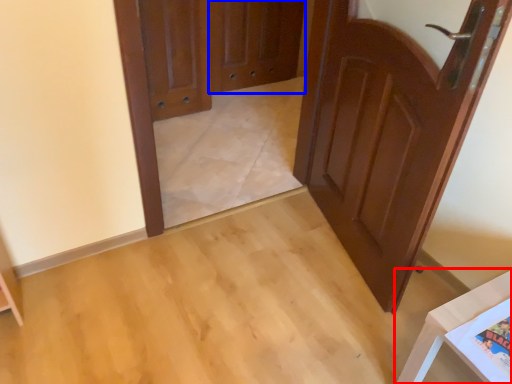
Question: Which object appears closest to the camera in this image, furniture (highlighted by a red box) or screen door (highlighted by a blue box)?

Choices:
 (A) furniture
 (B) screen door

Answer: (A)